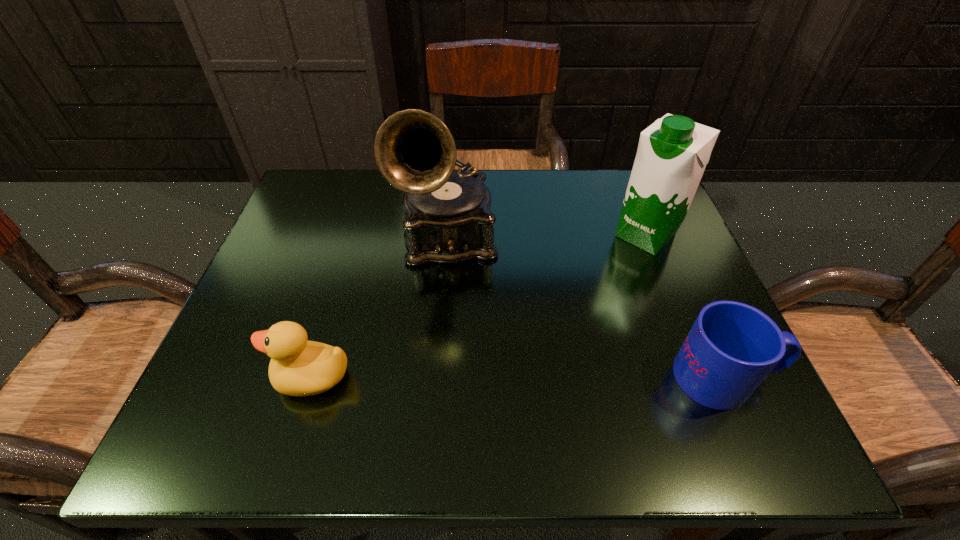
You are a GUI agent. You are given a task and a screenshot of the screen. Output one action in this format:
    pyautogui.click(x=<x>, y=<y>)
    Task: Click on the vacant space that satisfies the following two spatial constraints: 1. on the front side of the soya milk; 2. on the side with the handle of the mug
    This screenshot has width=960, height=540.
    Given the screenshot: What is the action you would take?
    pyautogui.click(x=702, y=377)

The height and width of the screenshot is (540, 960). I want to click on vacant position in the image that satisfies the following two spatial constraints: 1. on the front side of the mug; 2. on the side with the handle of the tallest object, so click(439, 377).

Identify the location of free space in the image that satisfies the following two spatial constraints: 1. on the back side of the third shortest object; 2. on the right side of the phonograph record. (449, 235).